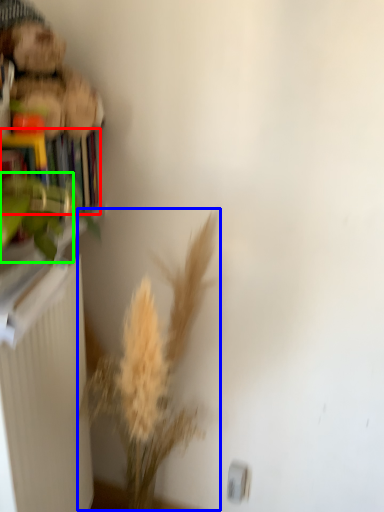
Question: Estimate the real-world distances between objects in this image. Which object is closer to book (highlighted by a red box), floral arrangement (highlighted by a blue box) or plant (highlighted by a green box)?

Choices:
 (A) floral arrangement
 (B) plant

Answer: (B)